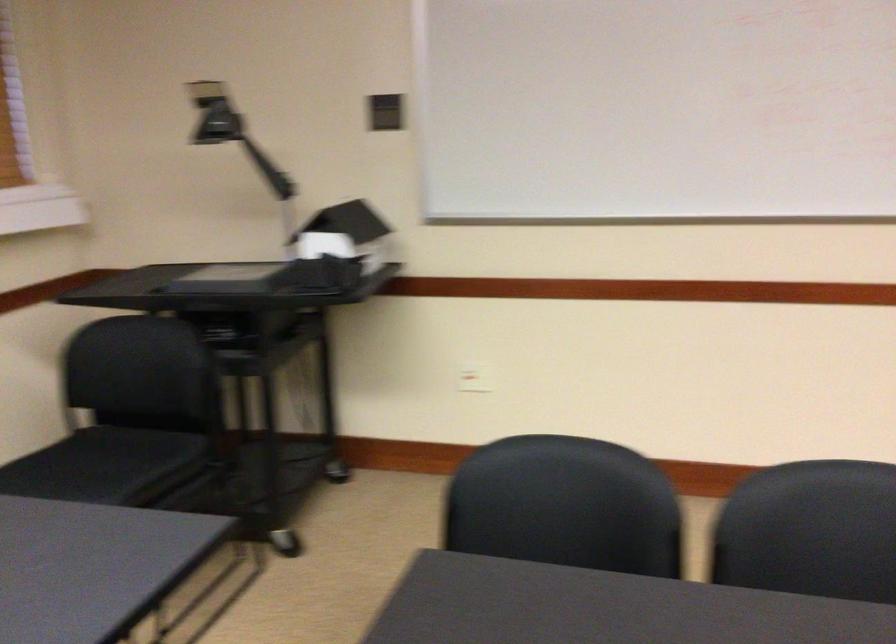
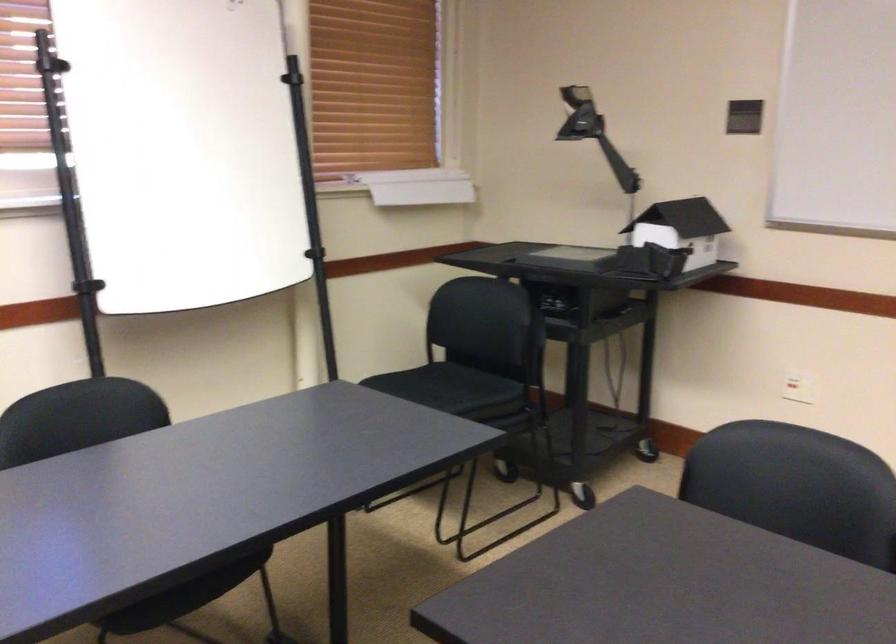
Where in the second image is the point corresponding to pixel 227 117 from the first image?

(579, 115)